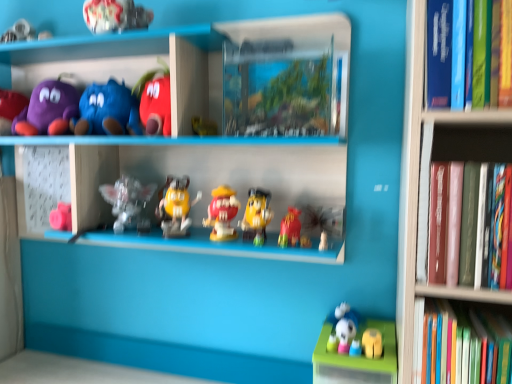
Question: Can you confirm if hardcover book at right, arranged as the second book when viewed from the top, is positioned to the left of matte yellow figure at center, acting as the 3th toy starting from the right?

Choices:
 (A) no
 (B) yes

Answer: (A)

Question: Considering the relative sizes of hardcover book at right, arranged as the second book when viewed from the top, and matte yellow figure at center, the eighth toy viewed from the left, in the image provided, is hardcover book at right, arranged as the second book when viewed from the top, bigger than matte yellow figure at center, the eighth toy viewed from the left,?

Choices:
 (A) no
 (B) yes

Answer: (B)

Question: Does hardcover book at right, which ranks as the 2th book in bottom-to-top order, have a greater width compared to matte yellow figure at center, the eighth toy viewed from the left?

Choices:
 (A) no
 (B) yes

Answer: (B)

Question: Is hardcover book at right, arranged as the second book when viewed from the top, turned away from matte yellow figure at center, acting as the 3th toy starting from the right?

Choices:
 (A) yes
 (B) no

Answer: (B)

Question: Is matte yellow figure at center, acting as the 3th toy starting from the right, completely or partially inside hardcover book at right, arranged as the second book when viewed from the top?

Choices:
 (A) no
 (B) yes

Answer: (A)

Question: Can you confirm if hardcover book at right, which ranks as the 2th book in bottom-to-top order, is thinner than matte yellow figure at center, the eighth toy viewed from the left?

Choices:
 (A) no
 (B) yes

Answer: (A)

Question: Is hardcover book at right, the 3th book positioned from the top, far from matte red bag at center, the 9th toy when ordered from left to right?

Choices:
 (A) no
 (B) yes

Answer: (A)

Question: Is hardcover book at right, acting as the 1th book starting from the bottom, smaller than matte red bag at center, which is the 2th toy in right-to-left order?

Choices:
 (A) no
 (B) yes

Answer: (A)

Question: From the image's perspective, would you say hardcover book at right, the 3th book positioned from the top, is positioned over matte red bag at center, the 9th toy when ordered from left to right?

Choices:
 (A) no
 (B) yes

Answer: (A)

Question: Is the position of hardcover book at right, the 3th book positioned from the top, more distant than that of matte red bag at center, the 9th toy when ordered from left to right?

Choices:
 (A) no
 (B) yes

Answer: (A)

Question: From a real-world perspective, is hardcover book at right, the 3th book positioned from the top, on top of matte red bag at center, which is the 2th toy in right-to-left order?

Choices:
 (A) no
 (B) yes

Answer: (A)

Question: Is hardcover book at right, the 3th book positioned from the top, outside of matte red bag at center, the 9th toy when ordered from left to right?

Choices:
 (A) no
 (B) yes

Answer: (B)

Question: Considering the relative sizes of purple plush toy at upper left, the second toy viewed from the left, and smooth plastic m&m figure at center, positioned as the seventh toy in left-to-right order, in the image provided, is purple plush toy at upper left, the second toy viewed from the left, smaller than smooth plastic m&m figure at center, positioned as the seventh toy in left-to-right order,?

Choices:
 (A) yes
 (B) no

Answer: (B)